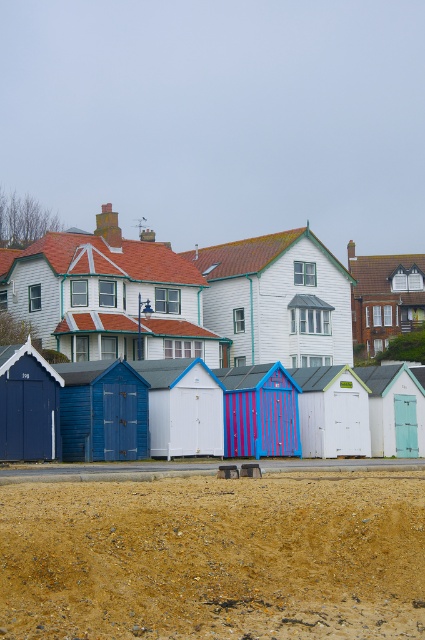
Question: In this image, where is white painted wood beach hut at center located relative to matte blue beach hut at left?

Choices:
 (A) above
 (B) below

Answer: (A)

Question: Does brown sandy dirt at lower center have a lesser width compared to white painted wood beach hut at center?

Choices:
 (A) yes
 (B) no

Answer: (A)

Question: Does white wood beach hut at center appear under white glossy beach hut at center?

Choices:
 (A) yes
 (B) no

Answer: (B)

Question: Estimate the real-world distances between objects in this image. Which object is farther from the brown sandy dirt at lower center?

Choices:
 (A) white wood beach hut at center
 (B) matte blue beach hut at left
 (C) white glossy beach hut at center

Answer: (A)

Question: Which object is closer to the camera taking this photo?

Choices:
 (A) white glossy beach hut at center
 (B) matte blue beach hut at left
 (C) white wood beach hut at center
 (D) brown sandy dirt at lower center

Answer: (D)

Question: Which point appears closest to the camera in this image?

Choices:
 (A) (215, 244)
 (B) (116, 531)

Answer: (B)